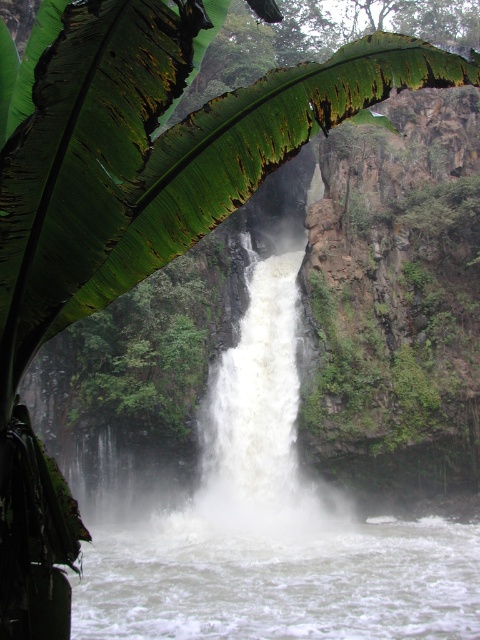
You are standing at the edge of the waterfall and want to place two markers at point (272, 115) and point (268, 224). Which marker will be closer to your current position?

Point (272, 115) is closer to the viewer than point (268, 224), so the marker at point (272, 115) will be closer to your current position.

You are a photographer trying to capture the white frothy water at center without the green leafy banana leaf at upper left blocking the view. Can you move your position to do so?

The green leafy banana leaf at upper left is closer to the viewer than the white frothy water at center, so moving your position might allow you to angle around the leaf to capture the water without obstruction.